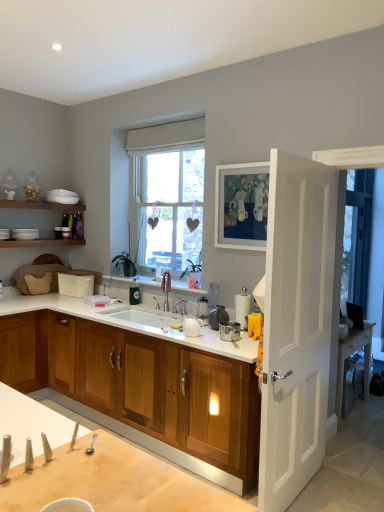
Question: From a real-world perspective, does white glossy sink at center sit lower than wooden cabinet at center?

Choices:
 (A) yes
 (B) no

Answer: (B)

Question: Can you confirm if white glossy sink at center is wider than wooden cabinet at center?

Choices:
 (A) yes
 (B) no

Answer: (B)

Question: Is white glossy sink at center directly adjacent to wooden cabinet at center?

Choices:
 (A) yes
 (B) no

Answer: (B)

Question: Is white glossy sink at center positioned in front of wooden cabinet at center?

Choices:
 (A) yes
 (B) no

Answer: (B)

Question: Does white glossy sink at center appear on the right side of wooden cabinet at center?

Choices:
 (A) yes
 (B) no

Answer: (B)

Question: In terms of size, does white matte picture frame at upper center appear bigger or smaller than white wooden door at right?

Choices:
 (A) small
 (B) big

Answer: (A)

Question: From the image's perspective, is white matte picture frame at upper center located above or below white wooden door at right?

Choices:
 (A) above
 (B) below

Answer: (A)

Question: Is white matte picture frame at upper center to the left or to the right of white wooden door at right in the image?

Choices:
 (A) right
 (B) left

Answer: (B)

Question: Is white matte picture frame at upper center spatially inside white wooden door at right, or outside of it?

Choices:
 (A) inside
 (B) outside

Answer: (B)

Question: Is wooden cabinet at center taller or shorter than white glossy countertop at center?

Choices:
 (A) tall
 (B) short

Answer: (A)

Question: Considering the positions of wooden cabinet at center and white glossy countertop at center in the image, is wooden cabinet at center bigger or smaller than white glossy countertop at center?

Choices:
 (A) big
 (B) small

Answer: (A)

Question: In the image, is wooden cabinet at center on the left side or the right side of white glossy countertop at center?

Choices:
 (A) left
 (B) right

Answer: (A)

Question: From the image's perspective, relative to white glossy countertop at center, is wooden cabinet at center above or below?

Choices:
 (A) below
 (B) above

Answer: (A)

Question: From their relative heights in the image, would you say white matte picture frame at upper center is taller or shorter than wooden cabinet at center?

Choices:
 (A) short
 (B) tall

Answer: (A)

Question: In the image, is white matte picture frame at upper center positioned in front of or behind wooden cabinet at center?

Choices:
 (A) front
 (B) behind

Answer: (B)